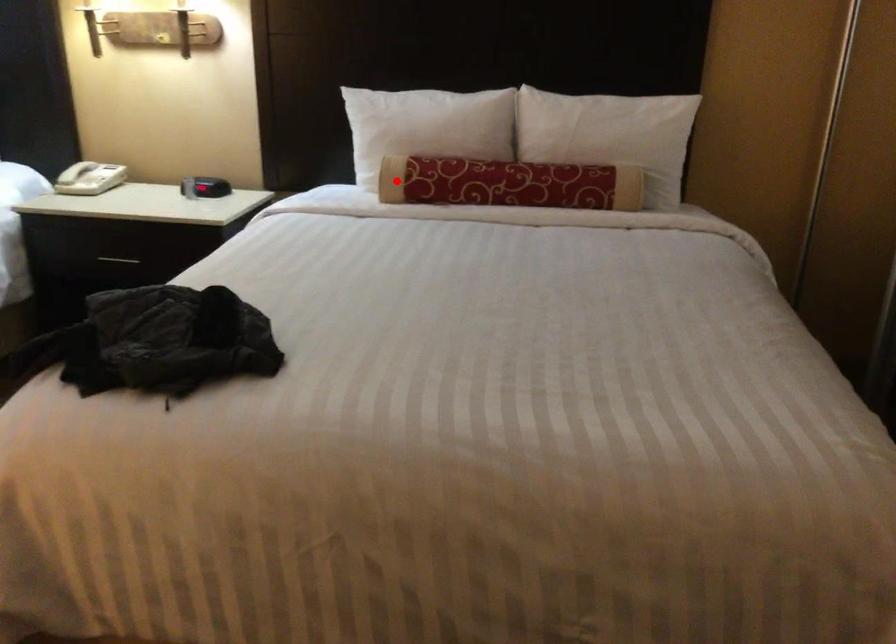
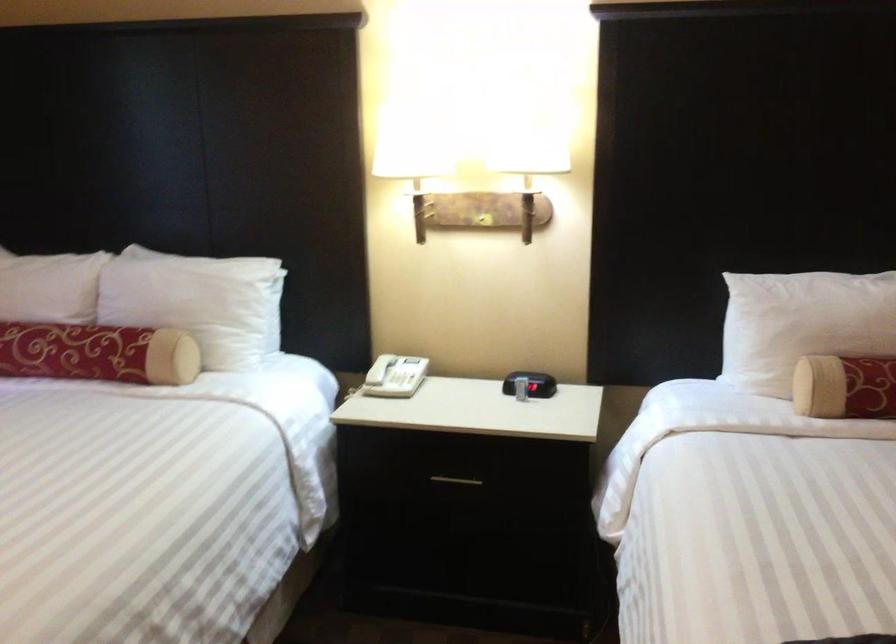
Question: I am providing you with two images of the same scene from different viewpoints. In image1, a red point is highlighted. Considering the same 3D point in image2, which of the following is correct?

Choices:
 (A) It is closer
 (B) It is farther

Answer: (A)